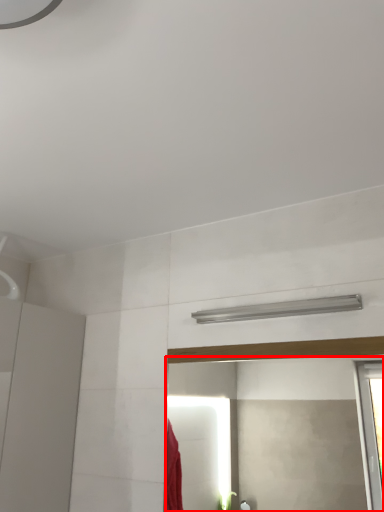
Question: From the image, what is the correct spatial relationship of mirror (annotated by the red box) in relation to shower?

Choices:
 (A) left
 (B) right

Answer: (A)